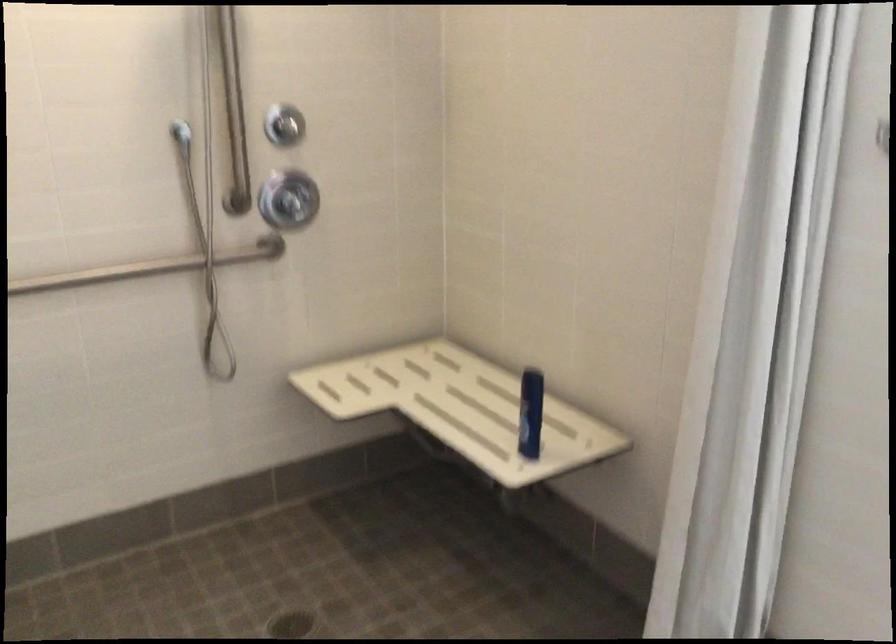
Find where to turn the small chrome knob. Please return your answer as a coordinate pair (x, y).

(282, 125)